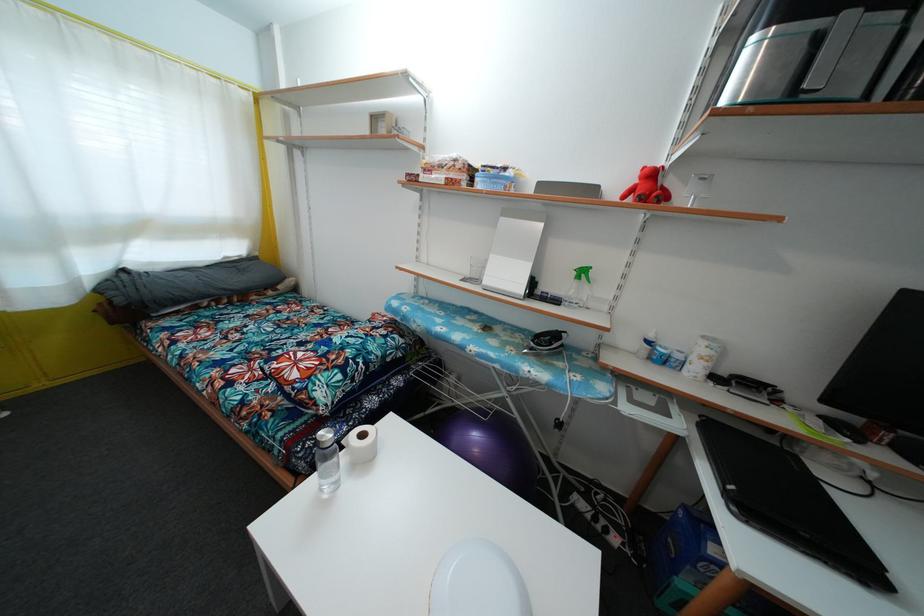
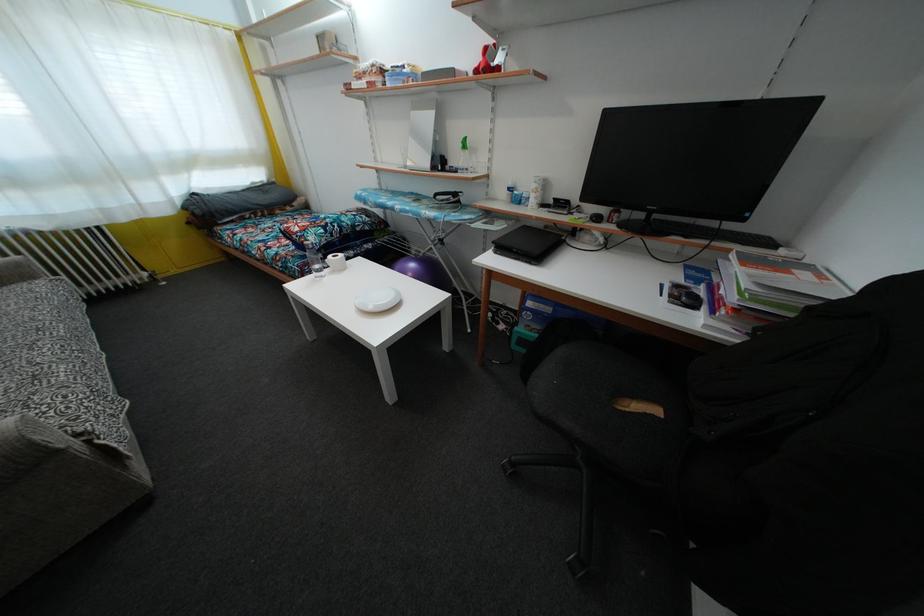
In the second image, find the point that corresponds to pixel 655 180 in the first image.

(490, 58)